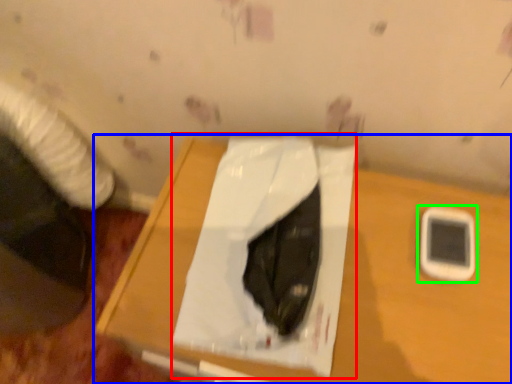
Question: Estimate the real-world distances between objects in this image. Which object is closer to sheet (highlighted by a red box), table (highlighted by a blue box) or mobile phone (highlighted by a green box)?

Choices:
 (A) table
 (B) mobile phone

Answer: (A)